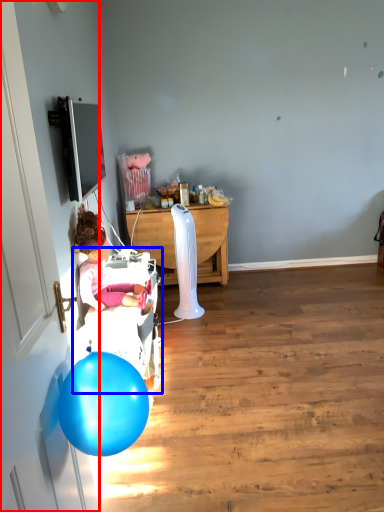
Question: Among these objects, which one is farthest to the camera, door (highlighted by a red box) or baby carriage (highlighted by a blue box)?

Choices:
 (A) door
 (B) baby carriage

Answer: (B)